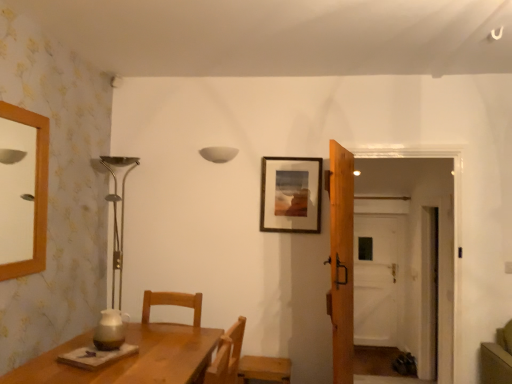
Question: Can you see white matte lampshade at upper center touching transparent glass door at center?

Choices:
 (A) yes
 (B) no

Answer: (B)

Question: Considering the relative positions of white matte lampshade at upper center and transparent glass door at center in the image provided, is white matte lampshade at upper center behind transparent glass door at center?

Choices:
 (A) yes
 (B) no

Answer: (B)

Question: From a real-world perspective, does white matte lampshade at upper center sit lower than transparent glass door at center?

Choices:
 (A) no
 (B) yes

Answer: (A)

Question: From a real-world perspective, is white matte lampshade at upper center on transparent glass door at center?

Choices:
 (A) yes
 (B) no

Answer: (A)

Question: Can you confirm if white matte lampshade at upper center is thinner than transparent glass door at center?

Choices:
 (A) yes
 (B) no

Answer: (A)

Question: From the image's perspective, is white matte lampshade at upper center under transparent glass door at center?

Choices:
 (A) yes
 (B) no

Answer: (B)

Question: From a real-world perspective, is transparent glass door at center on wooden door at center?

Choices:
 (A) no
 (B) yes

Answer: (A)

Question: From the image's perspective, does transparent glass door at center appear lower than wooden door at center?

Choices:
 (A) no
 (B) yes

Answer: (B)

Question: Does transparent glass door at center have a lesser height compared to wooden door at center?

Choices:
 (A) no
 (B) yes

Answer: (B)

Question: Is transparent glass door at center positioned far away from wooden door at center?

Choices:
 (A) no
 (B) yes

Answer: (B)

Question: Is the position of transparent glass door at center less distant than that of wooden door at center?

Choices:
 (A) yes
 (B) no

Answer: (B)

Question: Is transparent glass door at center behind wooden door at center?

Choices:
 (A) yes
 (B) no

Answer: (A)

Question: Would you say wooden chair at lower right contains wooden door at center?

Choices:
 (A) no
 (B) yes

Answer: (A)